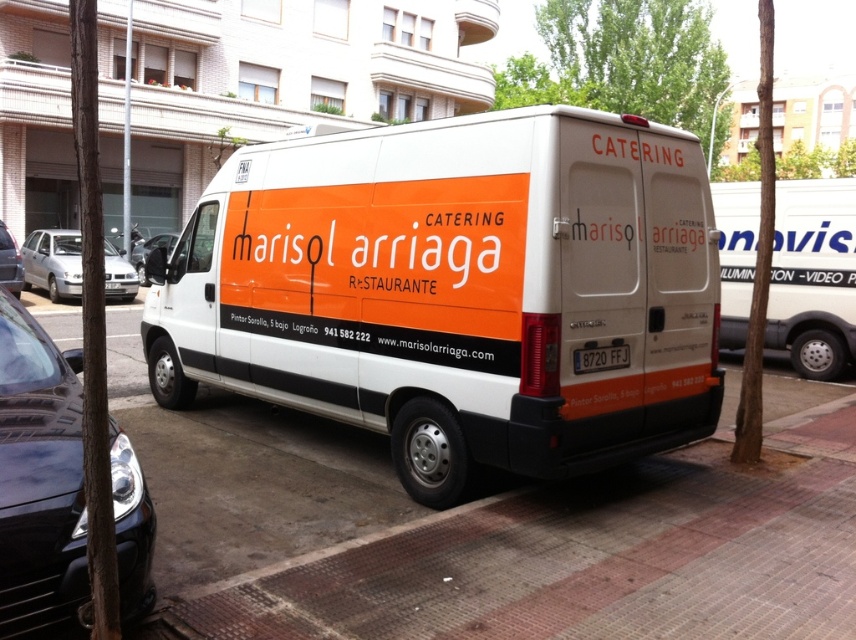
Question: Does black glossy car at lower left appear on the right side of matte silver van at center?

Choices:
 (A) yes
 (B) no

Answer: (A)

Question: Which point is closer to the camera?

Choices:
 (A) (746, 237)
 (B) (591, 365)

Answer: (B)

Question: Is black glossy car at lower left positioned behind matte silver van at center?

Choices:
 (A) yes
 (B) no

Answer: (B)

Question: Which of the following is the farthest from the observer?

Choices:
 (A) (116, 298)
 (B) (122, 609)
 (C) (603, 349)
 (D) (201, 589)

Answer: (A)

Question: Can you confirm if brick pavement at center is smaller than black glossy car at lower left?

Choices:
 (A) yes
 (B) no

Answer: (B)

Question: Which point is closer to the camera?

Choices:
 (A) black glossy car at lower left
 (B) matte silver van at center
 (C) brick pavement at center
 (D) white plastic license plate at center

Answer: (A)